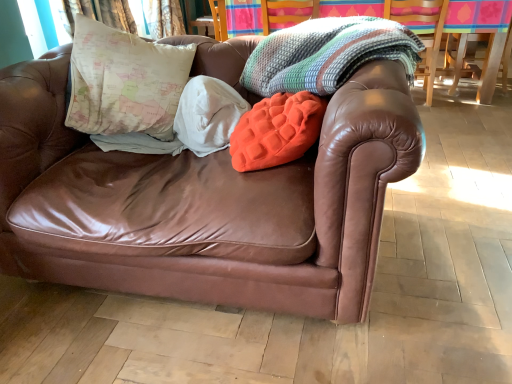
Question: Relative to knitted multicolored blanket at upper center, is brown leather couch at center in front or behind?

Choices:
 (A) front
 (B) behind

Answer: (A)

Question: Considering the positions of brown leather couch at center and knitted multicolored blanket at upper center in the image, is brown leather couch at center taller or shorter than knitted multicolored blanket at upper center?

Choices:
 (A) tall
 (B) short

Answer: (A)

Question: Which object is positioned closest to the orange fuzzy pillow at center?

Choices:
 (A) wooden swivel chair at upper right
 (B) map-patterned fabric pillow at upper left
 (C) knitted multicolor blanket at upper center, marked as the 1th blanket in a right-to-left arrangement
 (D) knitted multicolored blanket at upper center
 (E) brown leather couch at center

Answer: (C)

Question: Which of these objects is positioned farthest from the white soft blanket at center, the 2th blanket viewed from the right?

Choices:
 (A) knitted multicolor blanket at upper center, marked as the 1th blanket in a right-to-left arrangement
 (B) map-patterned fabric pillow at upper left
 (C) wooden swivel chair at upper right
 (D) orange fuzzy pillow at center
 (E) brown leather couch at center

Answer: (C)